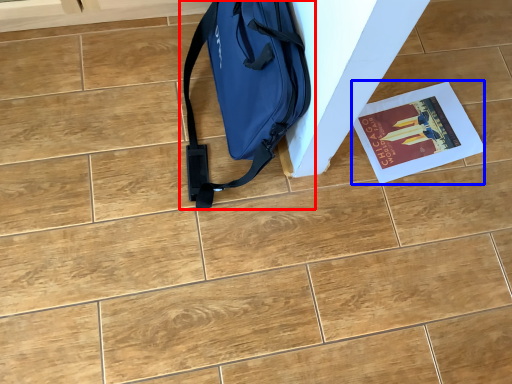
Question: Which of the following is the closest to the observer, luggage and bags (highlighted by a red box) or magazine (highlighted by a blue box)?

Choices:
 (A) luggage and bags
 (B) magazine

Answer: (A)